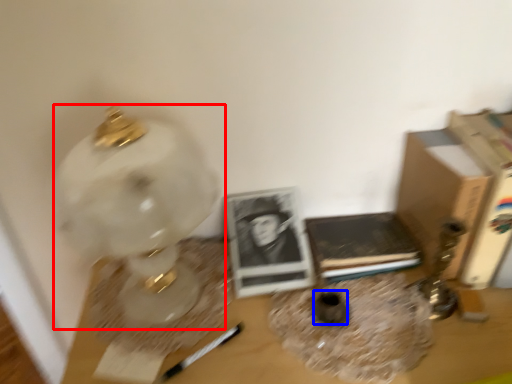
Question: Which object appears farthest to the camera in this image, lamp (highlighted by a red box) or vase (highlighted by a blue box)?

Choices:
 (A) lamp
 (B) vase

Answer: (B)